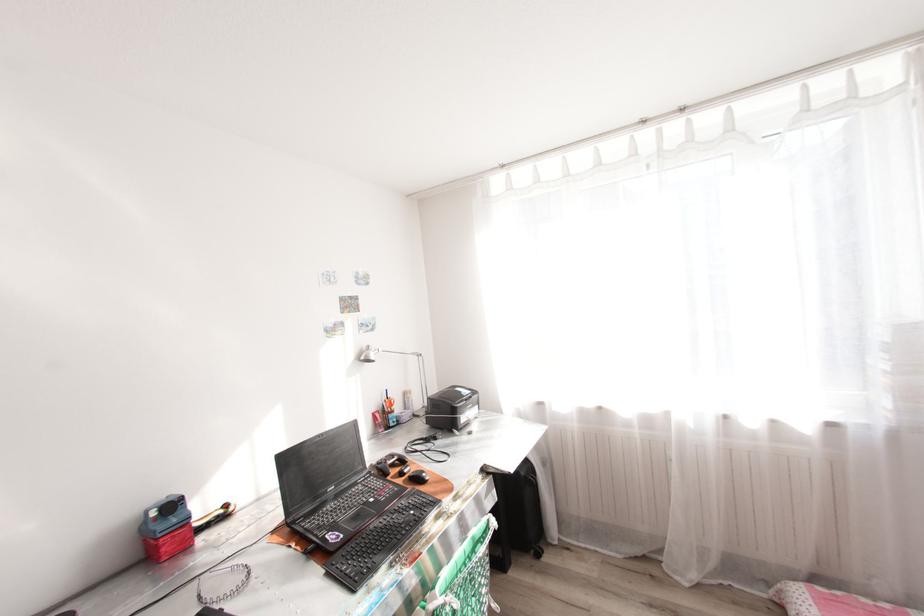
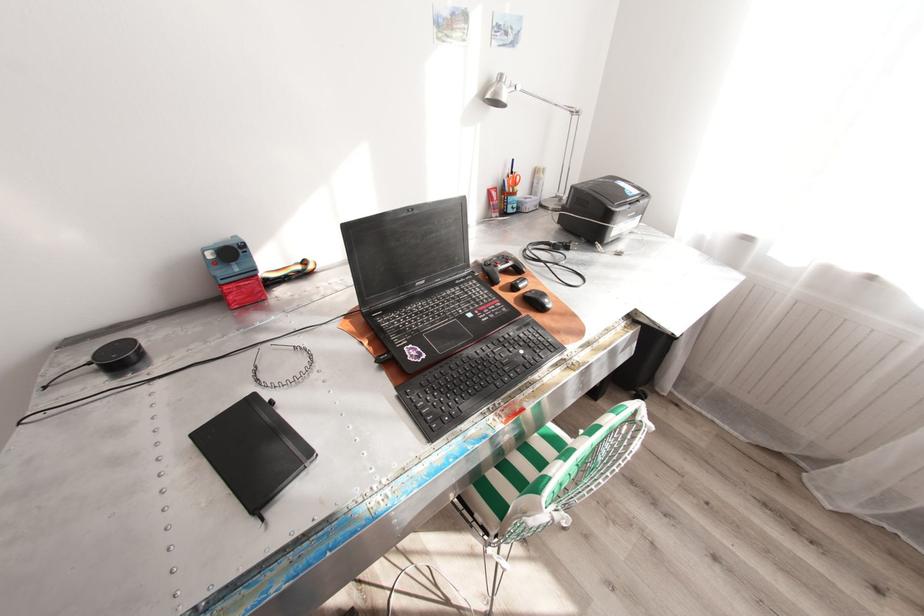
Where in the second image is the point corresponding to (199,582) from the first image?

(259, 351)